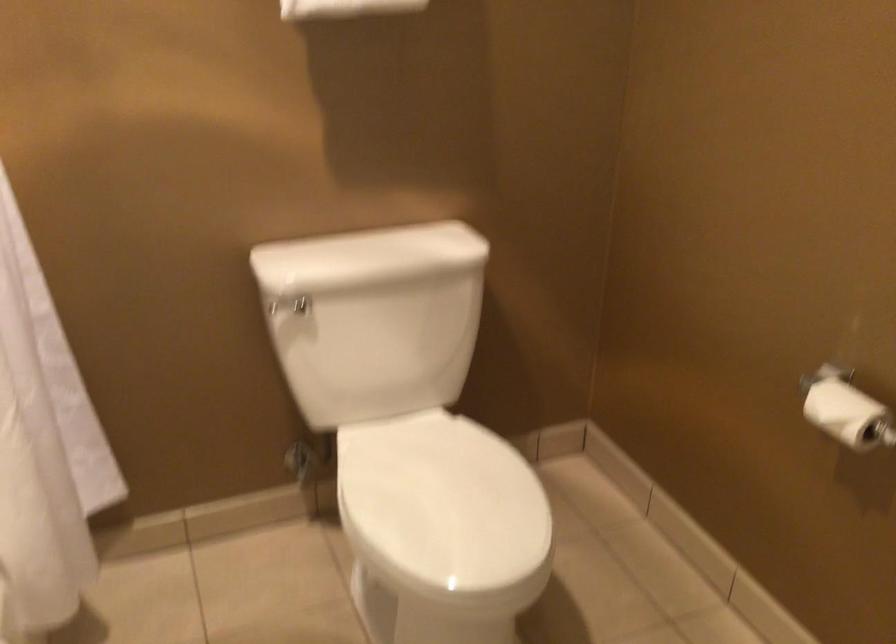
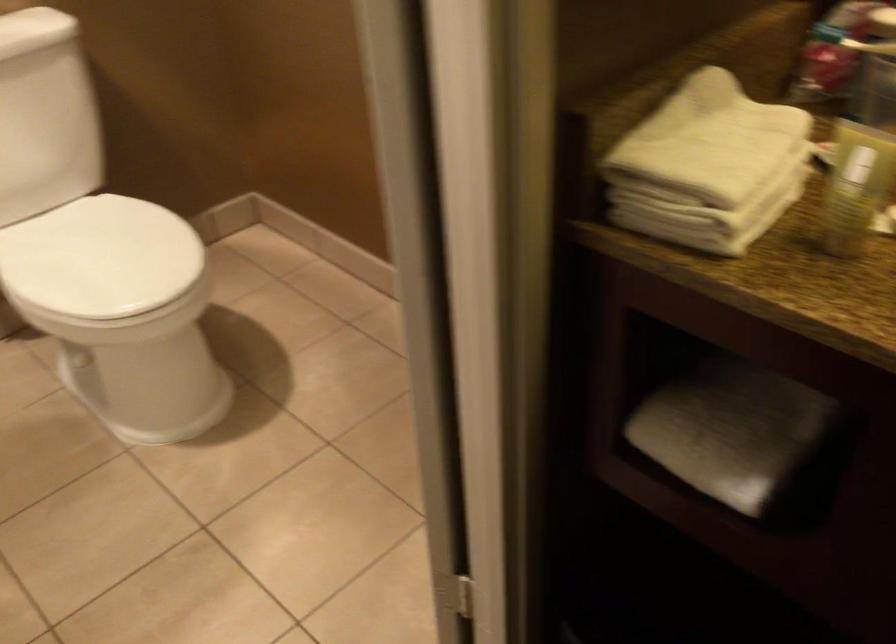
Question: I am providing you with two images of the same scene from different viewpoints. Which of the following objects are not visible in image2?

Choices:
 (A) white toilet lid
 (B) white and red bucket
 (C) toilet paper roll
 (D) yellow lotion bottle

Answer: (C)